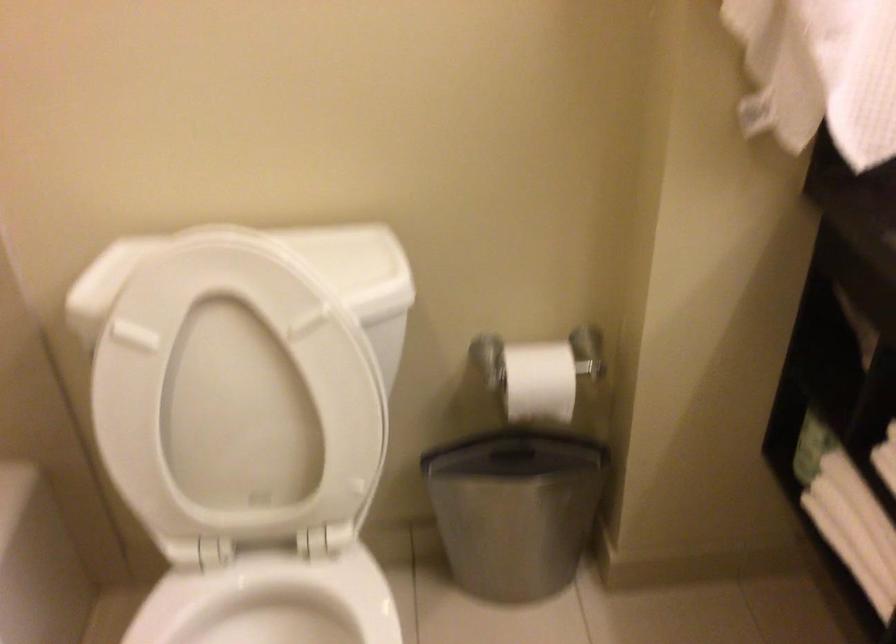
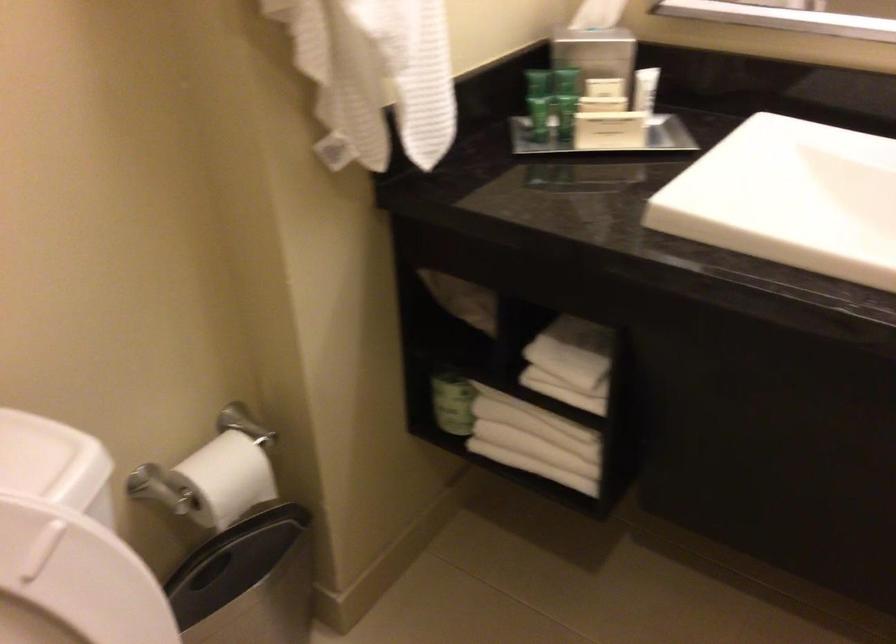
Find the pixel in the second image that matches the point at 316,351 in the first image.

(73, 582)